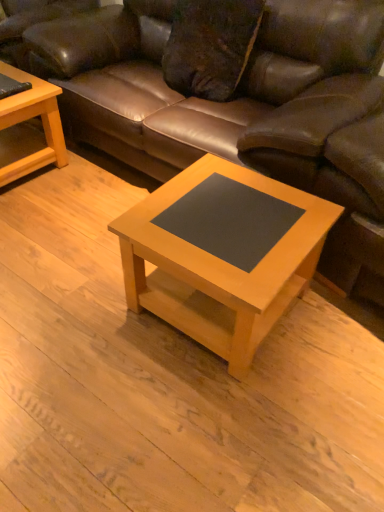
Question: Which direction should I rotate to face light wood/black laminate coffee table at center, which is the 1th coffee table from bottom to top, — up or down?

Choices:
 (A) down
 (B) up

Answer: (A)

Question: Is light wood/black laminate coffee table at center, placed as the first coffee table when sorted from right to left, taller than light wood/finely finished coffee table at left, which is the first coffee table in left-to-right order?

Choices:
 (A) no
 (B) yes

Answer: (B)

Question: Is light wood/black laminate coffee table at center, which is the 1th coffee table from bottom to top, next to light wood/finely finished coffee table at left, which is counted as the 2th coffee table, starting from the front?

Choices:
 (A) yes
 (B) no

Answer: (B)

Question: Is light wood/black laminate coffee table at center, arranged as the 2th coffee table when viewed from the top, at the right side of light wood/finely finished coffee table at left, the 1th coffee table in the back-to-front sequence?

Choices:
 (A) yes
 (B) no

Answer: (A)

Question: Does light wood/black laminate coffee table at center, the 2th coffee table when ordered from left to right, have a smaller size compared to light wood/finely finished coffee table at left, the first coffee table viewed from the top?

Choices:
 (A) no
 (B) yes

Answer: (A)

Question: From a real-world perspective, is light wood/black laminate coffee table at center, the 2th coffee table when ordered from left to right, on light wood/finely finished coffee table at left, the first coffee table viewed from the top?

Choices:
 (A) no
 (B) yes

Answer: (B)

Question: Is light wood/finely finished coffee table at left, which is counted as the 2th coffee table, starting from the front, completely or partially inside light wood/black laminate coffee table at center, arranged as the 2th coffee table when viewed from the top?

Choices:
 (A) no
 (B) yes

Answer: (A)

Question: Can you confirm if brown leather couch at center is thinner than light wood/finely finished coffee table at left, which is counted as the 2th coffee table, starting from the front?

Choices:
 (A) no
 (B) yes

Answer: (A)

Question: From a real-world perspective, is brown leather couch at center beneath light wood/finely finished coffee table at left, which appears as the second coffee table when ordered from the bottom?

Choices:
 (A) yes
 (B) no

Answer: (B)

Question: Can light wood/finely finished coffee table at left, which is the first coffee table in left-to-right order, be found inside brown leather couch at center?

Choices:
 (A) yes
 (B) no

Answer: (B)

Question: Is the depth of brown leather couch at center greater than that of light wood/finely finished coffee table at left, the 1th coffee table in the back-to-front sequence?

Choices:
 (A) yes
 (B) no

Answer: (B)

Question: Is brown leather couch at center wider than light wood/finely finished coffee table at left, which is the first coffee table in left-to-right order?

Choices:
 (A) no
 (B) yes

Answer: (B)

Question: Does brown leather couch at center have a greater height compared to light wood/finely finished coffee table at left, the first coffee table viewed from the top?

Choices:
 (A) no
 (B) yes

Answer: (B)

Question: Does light wood/finely finished coffee table at left, the 1th coffee table in the back-to-front sequence, have a lesser height compared to brown leather couch at center?

Choices:
 (A) no
 (B) yes

Answer: (B)